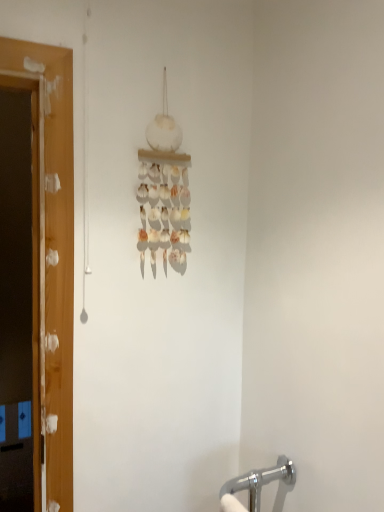
What is the approximate width of brown wooden door at left?

6.80 inches.

At what (x,y) coordinates should I click in order to perform the action: click on brown wooden door at left. Please return your answer as a coordinate pair (x, y). Looking at the image, I should click on (18, 300).

What do you see at coordinates (18, 300) in the screenshot? The image size is (384, 512). I see `brown wooden door at left` at bounding box center [18, 300].

Identify the location of brown wooden door at left. The height and width of the screenshot is (512, 384). [x=18, y=300].